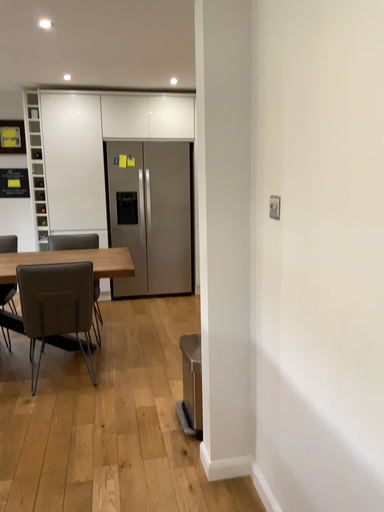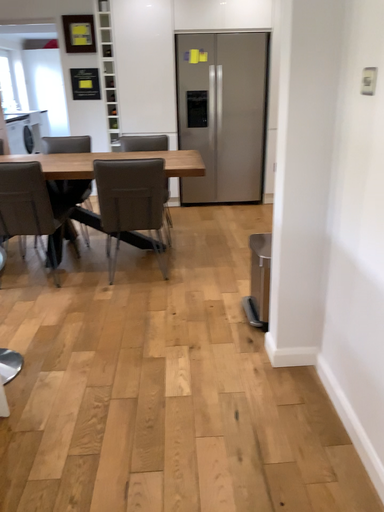
Question: How did the camera likely rotate when shooting the video?

Choices:
 (A) rotated upward
 (B) rotated downward

Answer: (B)